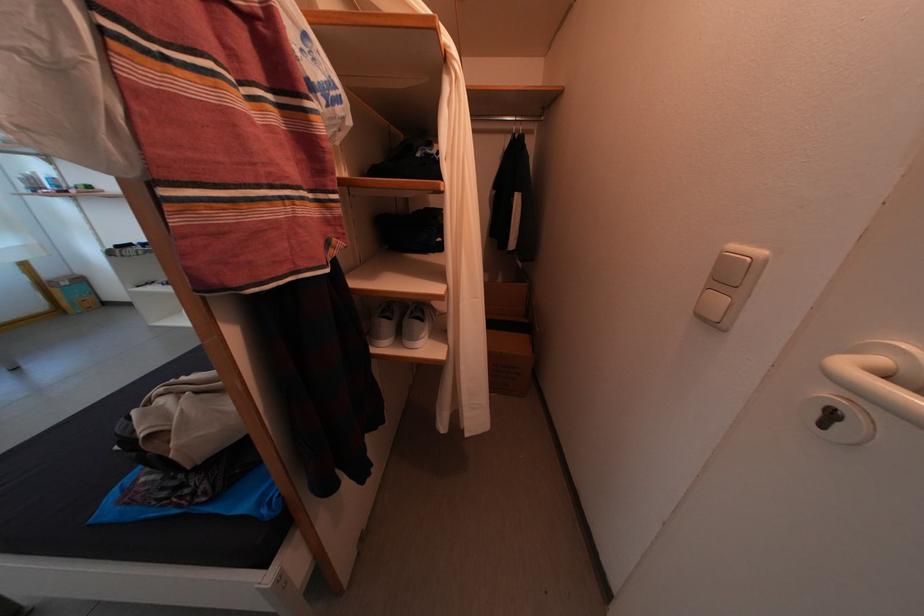
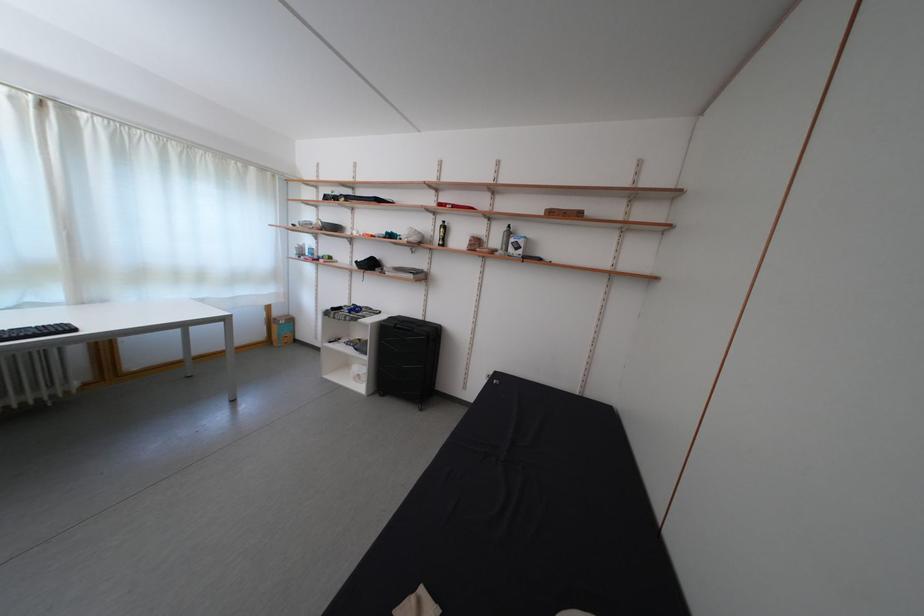
The point at (55, 281) is marked in the first image. Where is the corresponding point in the second image?

(285, 320)